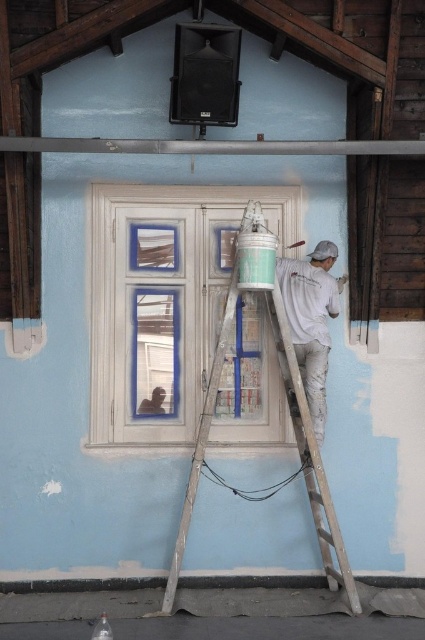
Question: Does wooden ladder at center appear on the right side of metallic gray beam at upper center?

Choices:
 (A) yes
 (B) no

Answer: (A)

Question: Which point is farther to the camera?

Choices:
 (A) white painted wood at center
 (B) white matte shirt at right
 (C) wooden ladder at center

Answer: (A)

Question: Does wooden ladder at center lie in front of white matte shirt at right?

Choices:
 (A) no
 (B) yes

Answer: (B)

Question: Can you confirm if white painted wood at center is positioned to the left of wooden ladder at center?

Choices:
 (A) yes
 (B) no

Answer: (A)

Question: Among these objects, which one is nearest to the camera?

Choices:
 (A) white matte shirt at right
 (B) metallic gray beam at upper center

Answer: (B)

Question: Which point appears farthest from the camera in this image?

Choices:
 (A) (176, 372)
 (B) (323, 316)
 (C) (333, 580)

Answer: (A)